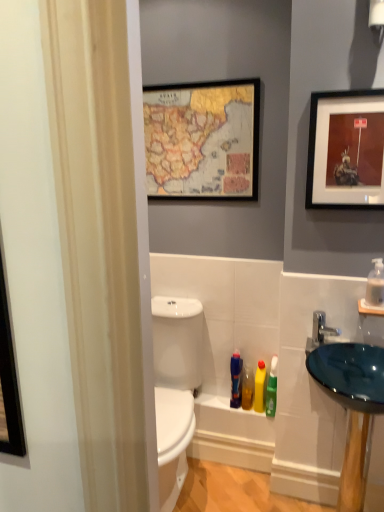
I want to click on vacant point to the right of silver metallic faucet at right, so (361, 349).